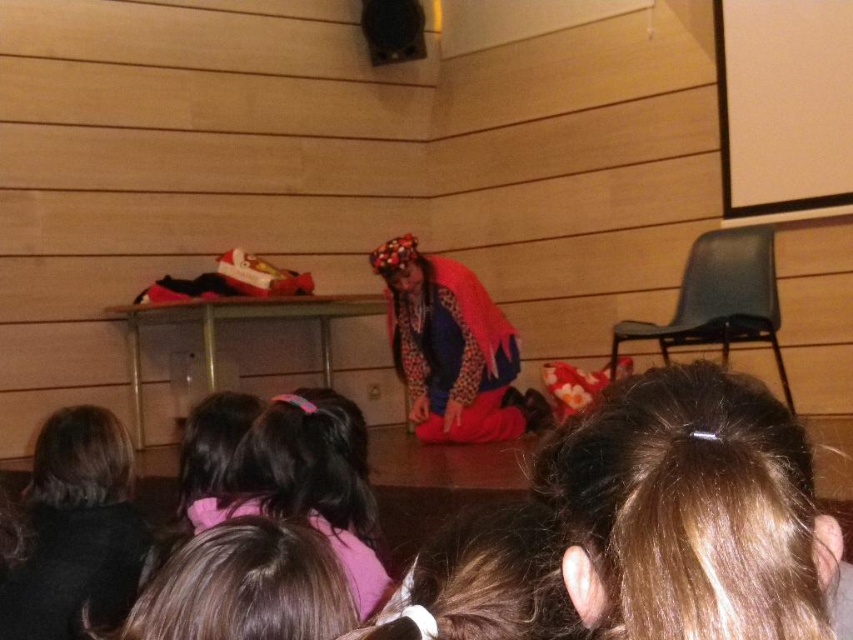
You are a photographer standing at the back of the classroom. You want to take a photo of both the brown hair at upper center and the dark brown hair at lower left. Which child do you need to zoom in on more to ensure they are both in focus?

The dark brown hair at lower left is further away from the viewer compared to the brown hair at upper center. To ensure both are in focus, you need to zoom in more on the dark brown hair at lower left since it is farther away.

You are a photographer in the classroom and want to capture both the brown hair at upper center and the dark brown hair at lower left in a single shot. Based on their positions, which one is positioned higher in the frame?

The brown hair at upper center is positioned higher in the frame than the dark brown hair at lower left.

You are standing in the classroom and need to locate the dark brown hair at lower left. According to the coordinates provided, where exactly should you look?

The dark brown hair at lower left is located at point 0.830 on the x axis and 0.090 on the y axis.